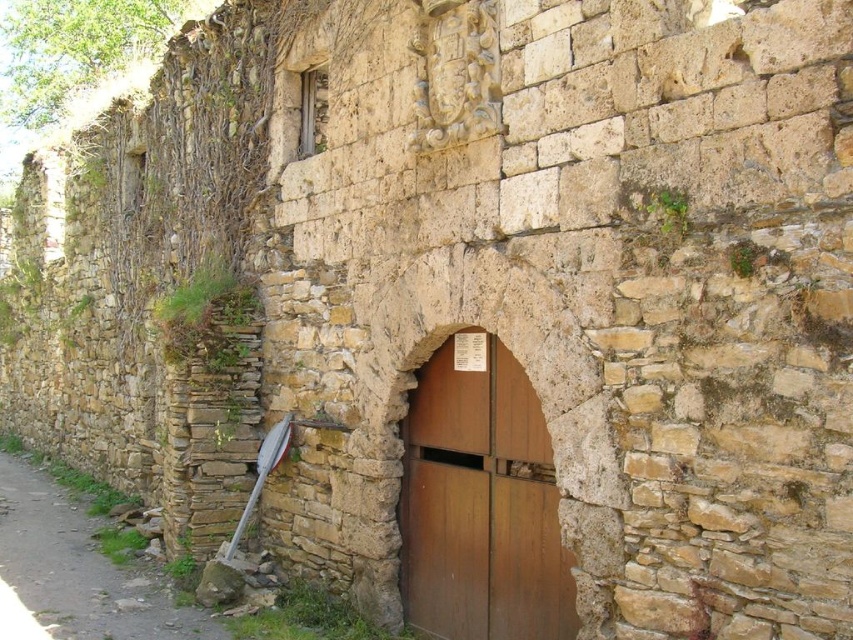
You are a delivery person with a cart that is 1.2 meters wide. You need to enter through the brown wooden door at center or use the dirt path at lower left. Which option allows your cart to pass through without getting stuck?

The brown wooden door at center is wider than the dirt path at lower left. Since your cart is 1.2 meters wide, you should use the brown wooden door at center as it can accommodate the cart.

You are standing at the dirt path at lower left and want to enter through the brown wooden door at center. Which direction should you move to reach the door?

The brown wooden door at center is located above the dirt path at lower left, so you should move upward or forward towards the door to reach it.

You are a traveler standing at the dirt path at lower left, wanting to enter the building through the brown wooden door at center. Can you walk directly to the door without stepping off the path?

The brown wooden door at center is in front of the dirt path at lower left, so you can walk directly to the door without needing to step off the path.